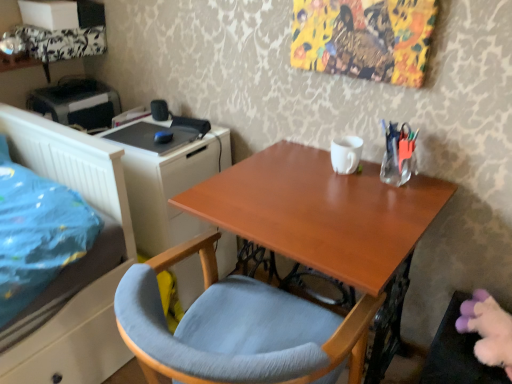
Question: Is black plastic printer at upper left positioned before white matte file cabinet at left?

Choices:
 (A) no
 (B) yes

Answer: (A)

Question: From the image's perspective, is black plastic printer at upper left above white matte file cabinet at left?

Choices:
 (A) yes
 (B) no

Answer: (A)

Question: Is black plastic printer at upper left at the right side of white matte file cabinet at left?

Choices:
 (A) yes
 (B) no

Answer: (B)

Question: Is black plastic printer at upper left not within white matte file cabinet at left?

Choices:
 (A) yes
 (B) no

Answer: (A)

Question: Does black plastic printer at upper left have a smaller size compared to white matte file cabinet at left?

Choices:
 (A) yes
 (B) no

Answer: (A)

Question: From a real-world perspective, does black plastic printer at upper left sit lower than white matte file cabinet at left?

Choices:
 (A) no
 (B) yes

Answer: (A)

Question: Considering the relative sizes of clear glass vase at upper right and light blue fabric chair at center in the image provided, is clear glass vase at upper right shorter than light blue fabric chair at center?

Choices:
 (A) no
 (B) yes

Answer: (B)

Question: Would you say clear glass vase at upper right is outside light blue fabric chair at center?

Choices:
 (A) yes
 (B) no

Answer: (A)

Question: Can you confirm if clear glass vase at upper right is positioned to the right of light blue fabric chair at center?

Choices:
 (A) yes
 (B) no

Answer: (A)

Question: Considering the relative sizes of clear glass vase at upper right and light blue fabric chair at center in the image provided, is clear glass vase at upper right smaller than light blue fabric chair at center?

Choices:
 (A) no
 (B) yes

Answer: (B)

Question: Does clear glass vase at upper right have a lesser width compared to light blue fabric chair at center?

Choices:
 (A) yes
 (B) no

Answer: (A)

Question: Is clear glass vase at upper right at the left side of light blue fabric chair at center?

Choices:
 (A) no
 (B) yes

Answer: (A)

Question: Does light blue fabric chair at center lie in front of black plastic printer at upper left?

Choices:
 (A) no
 (B) yes

Answer: (B)